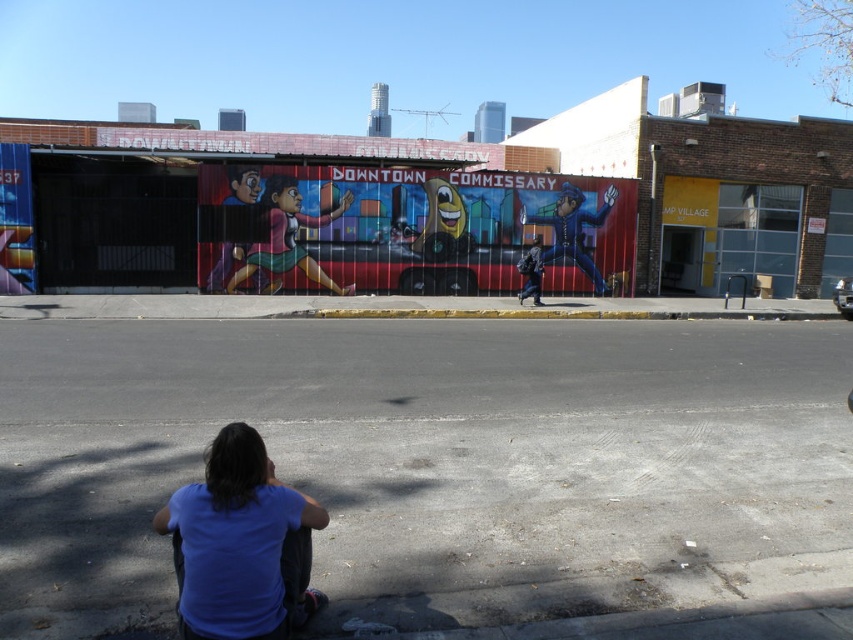
You are a pedestrian standing on the sidewalk and looking at the scene. Can you see the blue cotton shirt at lower center through the gray asphalt at lower center?

The blue cotton shirt at lower center is behind the gray asphalt at lower center, so it cannot be seen through the asphalt.